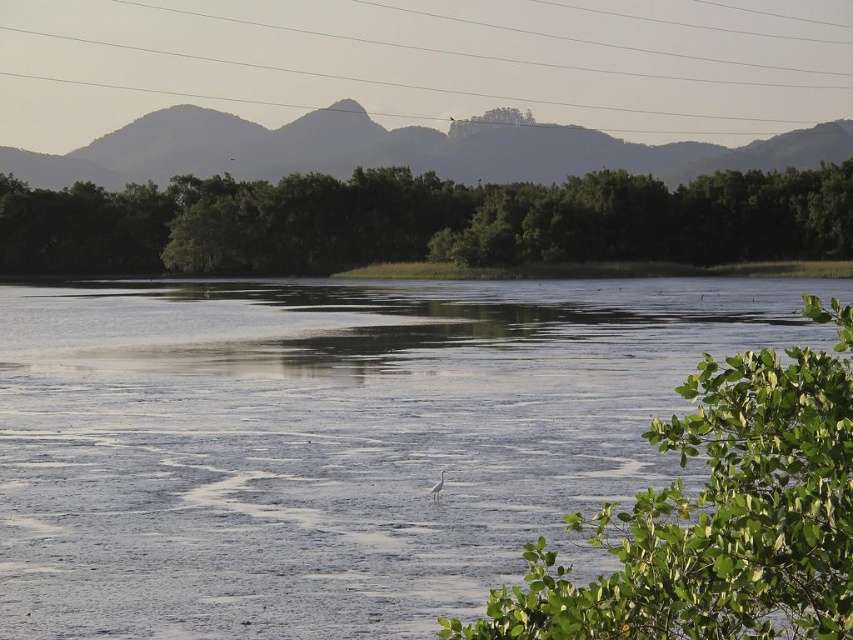
Is green leafy tree at lower right closer to camera compared to silvery gray mountain at upper center?

That is True.

Does point (767, 408) lie in front of point (280, 136)?

That is True.

Who is more distant from viewer, (831,593) or (349,150)?

The point (349,150) is more distant.

This screenshot has width=853, height=640. I want to click on green leafy tree at lower right, so click(717, 516).

Is green leafy trees at center smaller than silvery gray mountain at upper center?

No.

The height and width of the screenshot is (640, 853). What are the coordinates of `green leafy trees at center` in the screenshot? It's located at (422, 221).

This screenshot has height=640, width=853. Describe the element at coordinates (432, 60) in the screenshot. I see `smooth wire at upper center` at that location.

Which is below, smooth wire at upper center or green leafy tree at lower right?

Positioned lower is green leafy tree at lower right.

Who is more distant from viewer, (424, 42) or (639, 579)?

The point (424, 42) is more distant.

Locate an element on the screen. smooth wire at upper center is located at coordinates (432, 60).